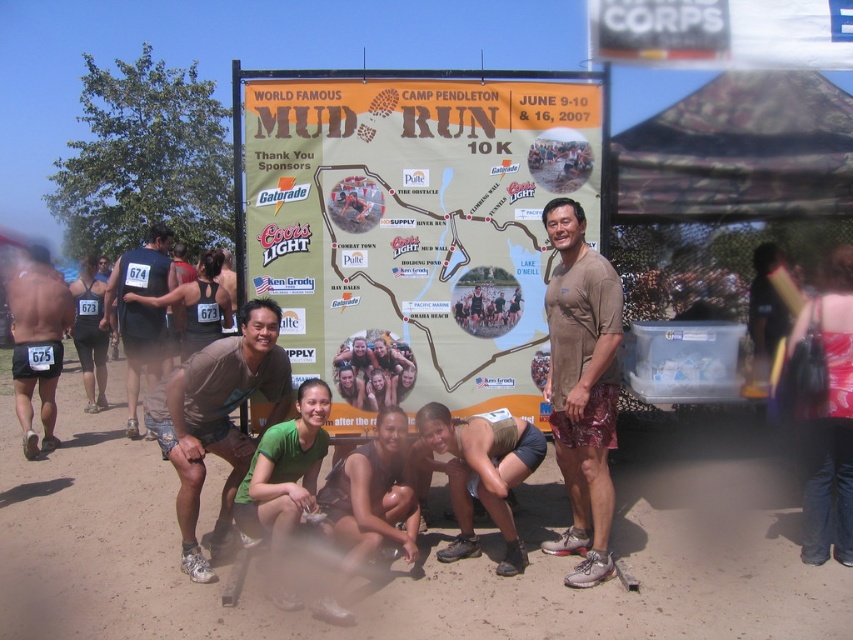
Question: Which point appears farthest from the camera in this image?

Choices:
 (A) (183, 522)
 (B) (152, 296)

Answer: (B)

Question: Which of the following is the farthest from the observer?

Choices:
 (A) pos(158,424)
 (B) pos(476,497)
 (C) pos(357,476)

Answer: (B)

Question: Which of the following is the farthest from the observer?

Choices:
 (A) (161, 582)
 (B) (49, 356)
 (C) (157, 264)

Answer: (C)

Question: Does brown cotton t-shirt at center appear on the left side of matte green tank top at center?

Choices:
 (A) yes
 (B) no

Answer: (B)

Question: Can you confirm if brown fabric shirt at center is smaller than matte black shorts at left?

Choices:
 (A) yes
 (B) no

Answer: (B)

Question: Is brown fabric shirt at center closer to the viewer compared to green fabric shirt at center?

Choices:
 (A) yes
 (B) no

Answer: (B)